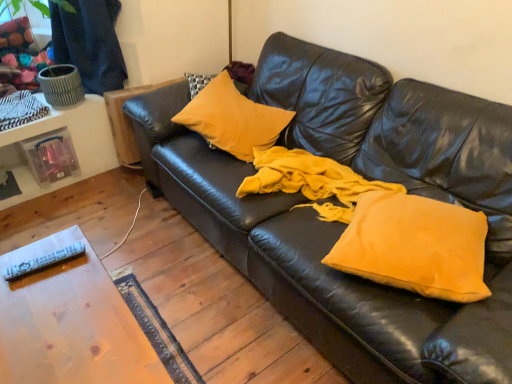
Find the location of a particular element. The image size is (512, 384). vacant space to the right of white plastic remote at lower left is located at coordinates (78, 274).